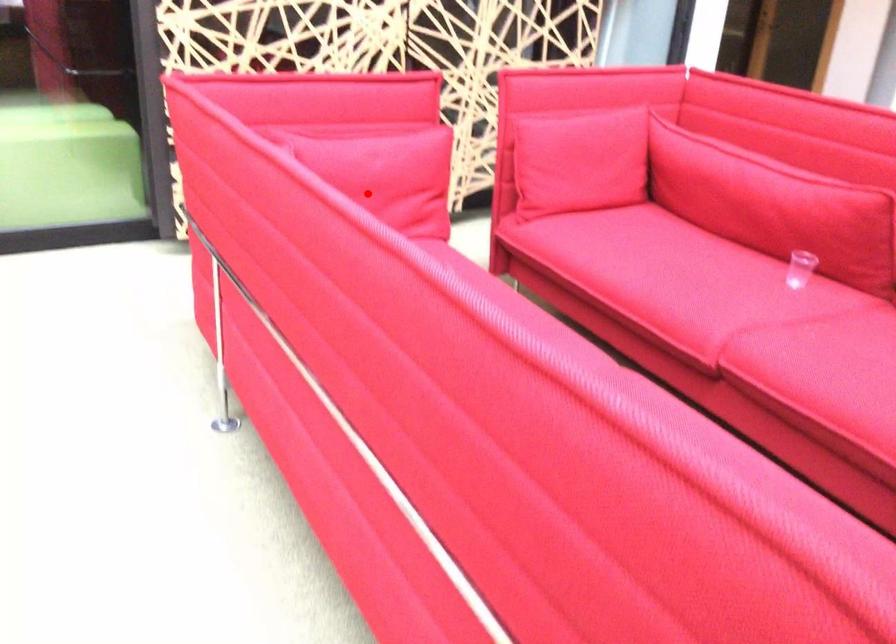
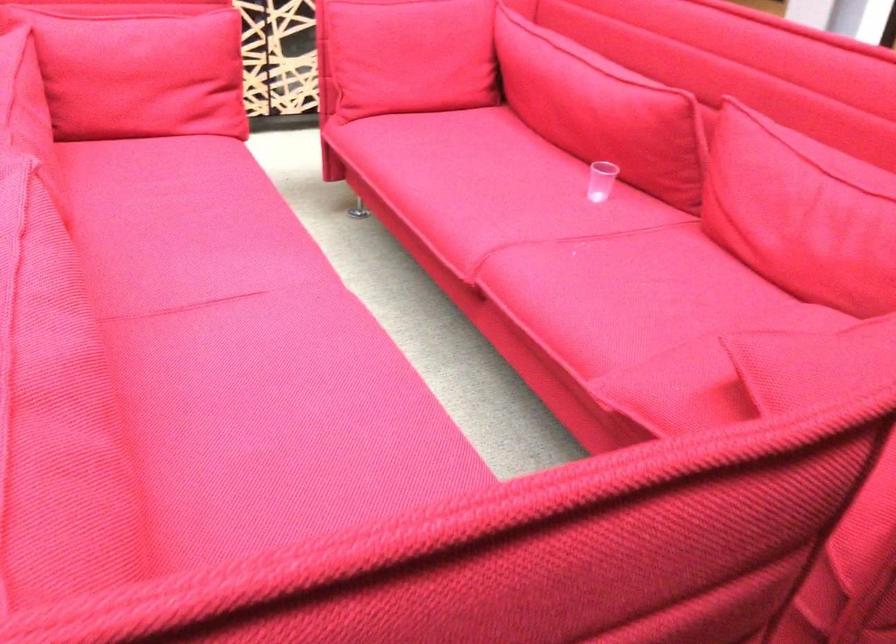
Where in the second image is the point corresponding to the highlighted location from the first image?

(142, 76)